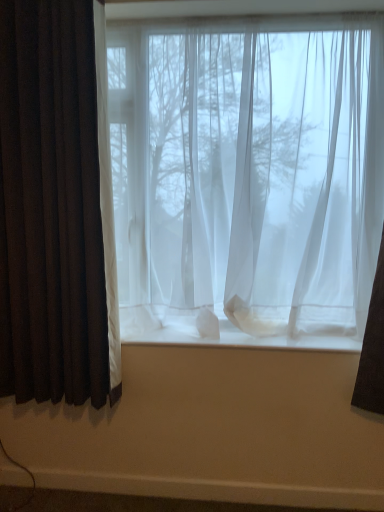
Question: From a real-world perspective, is sheer white curtains at center on top of white sheer curtain at center?

Choices:
 (A) no
 (B) yes

Answer: (B)

Question: Is sheer white curtains at center wider than white sheer curtain at center?

Choices:
 (A) no
 (B) yes

Answer: (B)

Question: Is the surface of sheer white curtains at center in direct contact with white sheer curtain at center?

Choices:
 (A) no
 (B) yes

Answer: (A)

Question: Can you confirm if sheer white curtains at center is bigger than white sheer curtain at center?

Choices:
 (A) no
 (B) yes

Answer: (B)

Question: Could you tell me if sheer white curtains at center is turned towards white sheer curtain at center?

Choices:
 (A) yes
 (B) no

Answer: (B)

Question: From a real-world perspective, is white sheer curtain at center above or below dark brown velvet curtain at left?

Choices:
 (A) below
 (B) above

Answer: (A)

Question: In terms of height, does white sheer curtain at center look taller or shorter compared to dark brown velvet curtain at left?

Choices:
 (A) short
 (B) tall

Answer: (A)

Question: Looking at their shapes, would you say white sheer curtain at center is wider or thinner than dark brown velvet curtain at left?

Choices:
 (A) thin
 (B) wide

Answer: (B)

Question: In the image, is white sheer curtain at center on the left side or the right side of dark brown velvet curtain at left?

Choices:
 (A) right
 (B) left

Answer: (A)

Question: Is point (72, 39) closer or farther from the camera than point (129, 313)?

Choices:
 (A) closer
 (B) farther

Answer: (A)

Question: Is dark brown velvet curtain at left situated inside white sheer curtain at center or outside?

Choices:
 (A) outside
 (B) inside

Answer: (A)

Question: In terms of size, does dark brown velvet curtain at left appear bigger or smaller than white sheer curtain at center?

Choices:
 (A) big
 (B) small

Answer: (A)

Question: From the image's perspective, is dark brown velvet curtain at left above or below white sheer curtain at center?

Choices:
 (A) below
 (B) above

Answer: (B)

Question: Is sheer white curtains at center bigger or smaller than white sheer curtain at center?

Choices:
 (A) small
 (B) big

Answer: (B)

Question: Would you say sheer white curtains at center is to the left or to the right of white sheer curtain at center in the picture?

Choices:
 (A) left
 (B) right

Answer: (A)